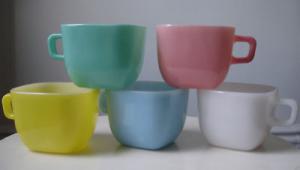
I want to click on the bottom row of cups, so click(226, 110), click(136, 110), click(56, 111).